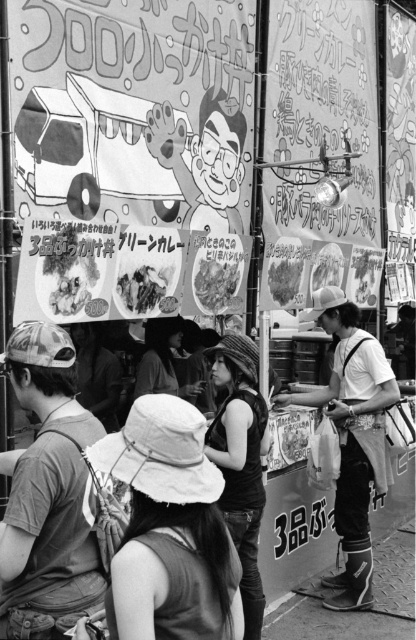
You are a photographer trying to capture the entire metallic silver food truck at upper left and the white fabric apron at right in one frame. Based on their sizes, will you need to adjust your camera angle to include both?

The metallic silver food truck at upper left might be wider than white fabric apron at right, so you might need to adjust your camera angle to ensure both are fully visible in the frame.

You are a food truck driver who needs to park your truck exactly 10 feet away from the white fabric apron at right. Currently, your metallic silver food truck at upper left is parked 8.18 feet away from it. Should you move your truck closer or farther away to meet the requirement?

The metallic silver food truck at upper left is currently 8.18 feet away from the white fabric apron at right. Since 8.18 feet is less than 10 feet, you need to move the truck farther away to reach the required distance of 10 feet.

You are a photographer standing in front of the metallic silver food truck at upper left and the white fabric apron at right. You want to take a photo that includes both objects in the frame. Which object should you position closer to the camera to ensure both are fully visible?

To ensure both the metallic silver food truck at upper left and the white fabric apron at right are fully visible in the photo, you should position the metallic silver food truck at upper left closer to the camera since it has a lesser height compared to the white fabric apron at right. This way, both objects will fit within the frame without one being cut off.